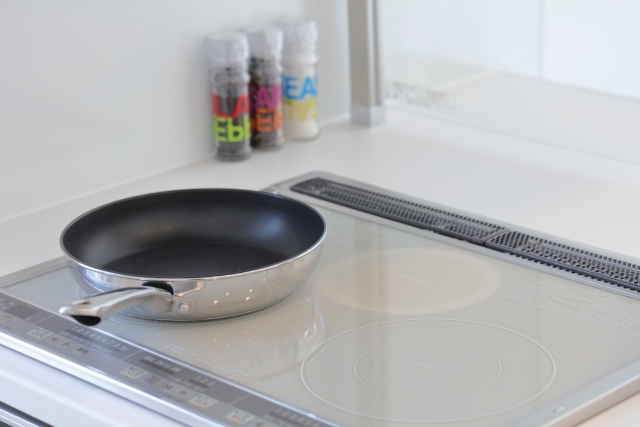
Locate an element on the screen. This screenshot has width=640, height=427. counter space behind stove is located at coordinates (512, 188).